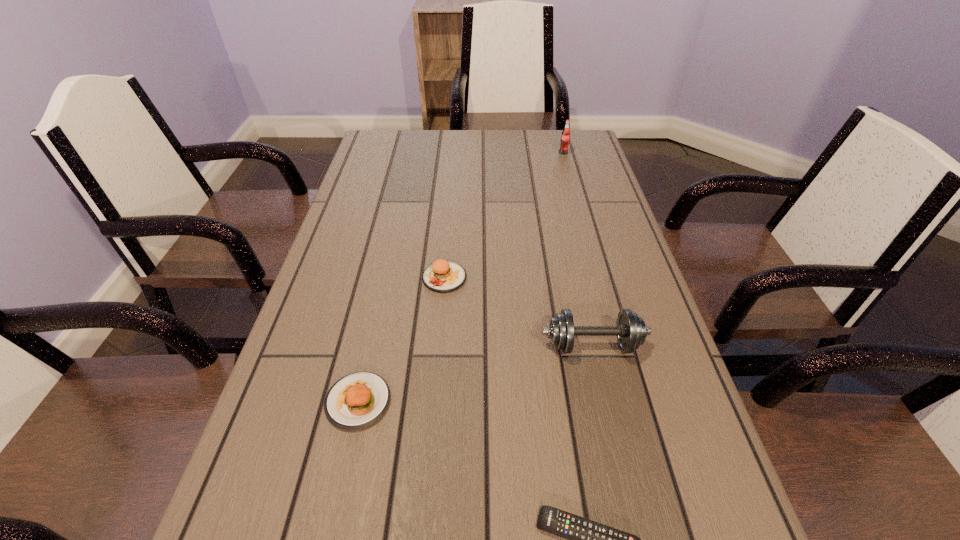
Locate an element on the screen. the tallest object is located at coordinates (565, 137).

Image resolution: width=960 pixels, height=540 pixels. Find the location of `the farthest object`. the farthest object is located at coordinates (565, 137).

Locate an element on the screen. The width and height of the screenshot is (960, 540). dumbbell is located at coordinates (631, 331).

Identify the location of the third nearest object. The image size is (960, 540). (631, 331).

The image size is (960, 540). Identify the location of the farther food. point(442,276).

Locate an element on the screen. The width and height of the screenshot is (960, 540). the taller food is located at coordinates (442, 276).

Locate an element on the screen. The height and width of the screenshot is (540, 960). the nearer food is located at coordinates (357, 400).

I want to click on the leftmost object, so click(x=357, y=400).

Locate an element on the screen. vacant space located on the label of the farthest object is located at coordinates (579, 212).

The image size is (960, 540). Identify the location of free space located on the left of the fourth shortest object. (407, 345).